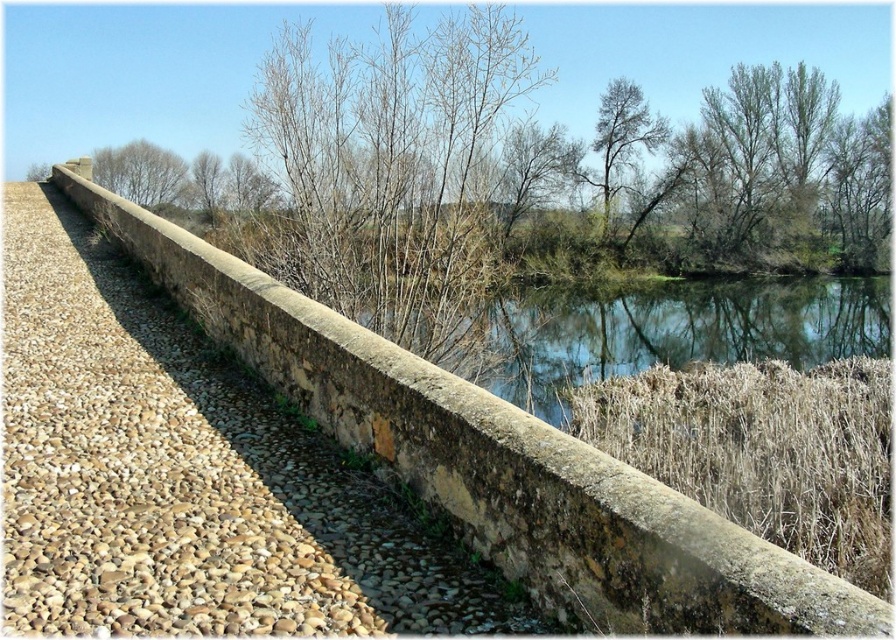
Between greenish-blue water at center and green leafy tree at upper center, which one appears on the right side from the viewer's perspective?

Positioned to the right is green leafy tree at upper center.

Does greenish-blue water at center appear under green leafy tree at upper center?

Correct, greenish-blue water at center is located below green leafy tree at upper center.

Who is more forward, (x=788, y=330) or (x=655, y=116)?

Positioned in front is point (x=788, y=330).

Locate an element on the screen. The height and width of the screenshot is (640, 896). greenish-blue water at center is located at coordinates (662, 332).

Is stone wall at center above brown wood tree at upper left?

No.

Which of these two, stone wall at center or brown wood tree at upper left, stands taller?

With more height is brown wood tree at upper left.

I want to click on stone wall at center, so click(x=494, y=461).

Who is positioned more to the left, green leafy tree at upper center or brown leafless tree at upper center?

From the viewer's perspective, brown leafless tree at upper center appears more on the left side.

Where is `green leafy tree at upper center`? green leafy tree at upper center is located at coordinates (619, 140).